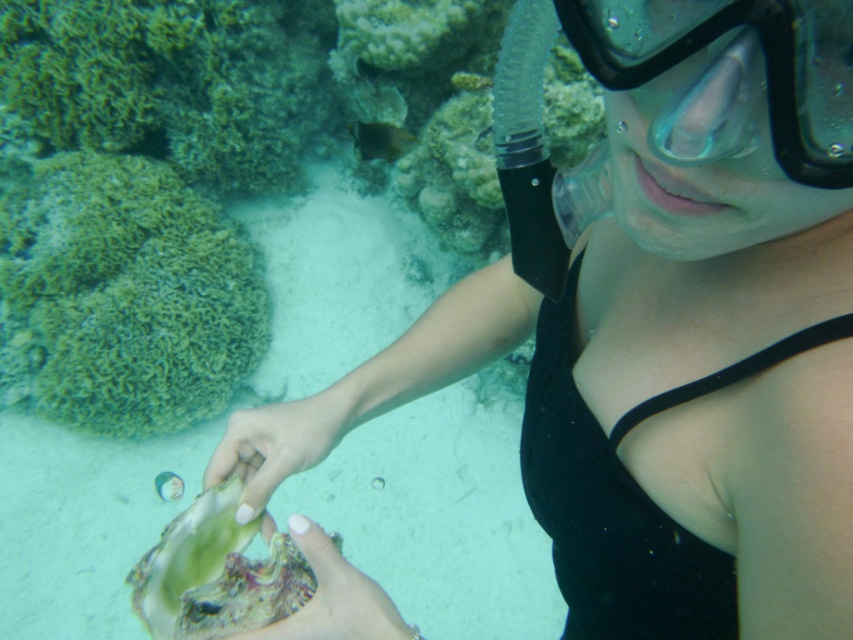
You are a marine biologist observing an underwater scene. You notice the green soft coral at left and the green iridescent shell at center. Based on their positions, which object is closer to the surface of the water?

The green soft coral at left is located above the green iridescent shell at center, so it is closer to the surface of the water.

You are a marine biologist observing the underwater scene. You notice the transparent rubber goggles at upper center and the pale skin at center. Which object is located to the right of the other?

The transparent rubber goggles at upper center is positioned on the right side of pale skin at center.

Based on the photo, you are a marine biologist observing an underwater scene. You notice the green soft coral at left and the pale skin at center. Which object is larger in size?

The green soft coral at left is bigger than the pale skin at center.